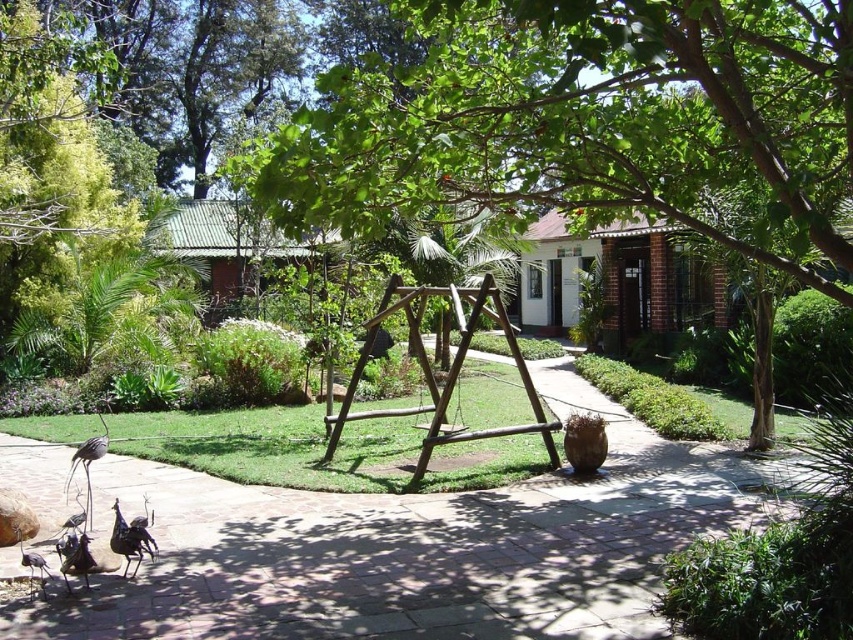
You are planning to place a new bench in the garden. The bench is the same size as the brown wooden swing at center. If you want to ensure the bench is not larger than the green leafy tree at center, where should you place it?

The green leafy tree at center is bigger than the brown wooden swing at center. Since the bench is the same size as the brown wooden swing at center, placing it anywhere in the garden will ensure it is not larger than the tree.

You are standing at the point labeled as point (589,122) in the garden. What is the nearest object to you?

The nearest object to you is the green leafy tree at center because the point (589,122) is located on it.

You are planning to place a large garden ornament that requires a flat, stable surface. Based on the scene, which object between the paved stone path at center and the brown wooden swing at center would be more suitable for placing the ornament?

The paved stone path at center is bigger than the brown wooden swing at center, making it a more stable and suitable surface for placing the large garden ornament.